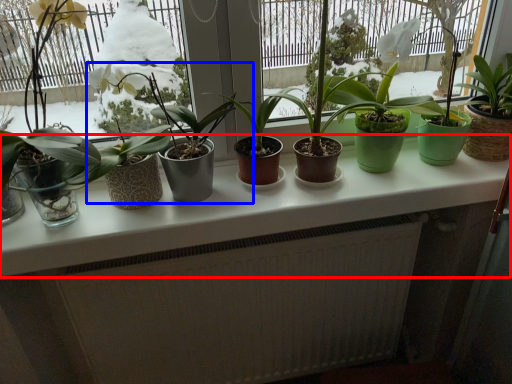
Question: Which object is closer to the camera taking this photo, counter top (highlighted by a red box) or houseplant (highlighted by a blue box)?

Choices:
 (A) counter top
 (B) houseplant

Answer: (B)